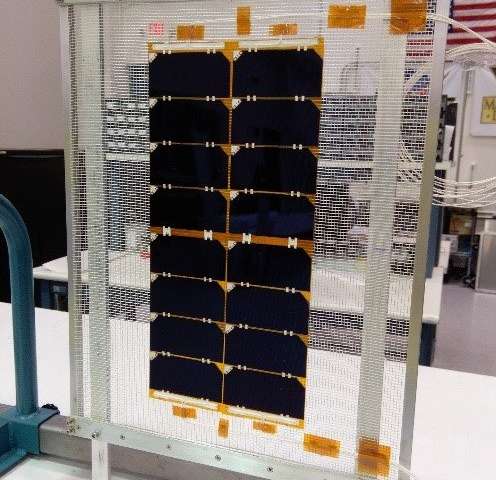
Image resolution: width=496 pixels, height=480 pixels. What are the coordinates of `table` in the screenshot? It's located at (x=428, y=314).